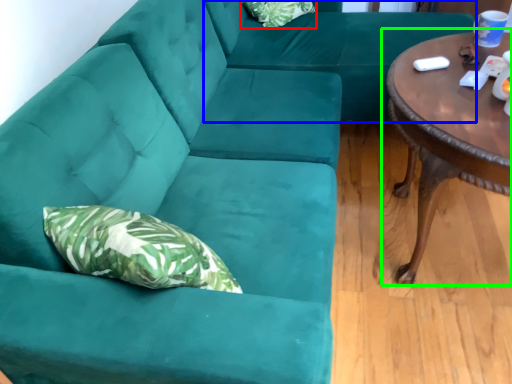
Question: Which object is the farthest from pillow (highlighted by a red box)? Choose among these: couch (highlighted by a blue box) or coffee table (highlighted by a green box).

Choices:
 (A) couch
 (B) coffee table

Answer: (B)